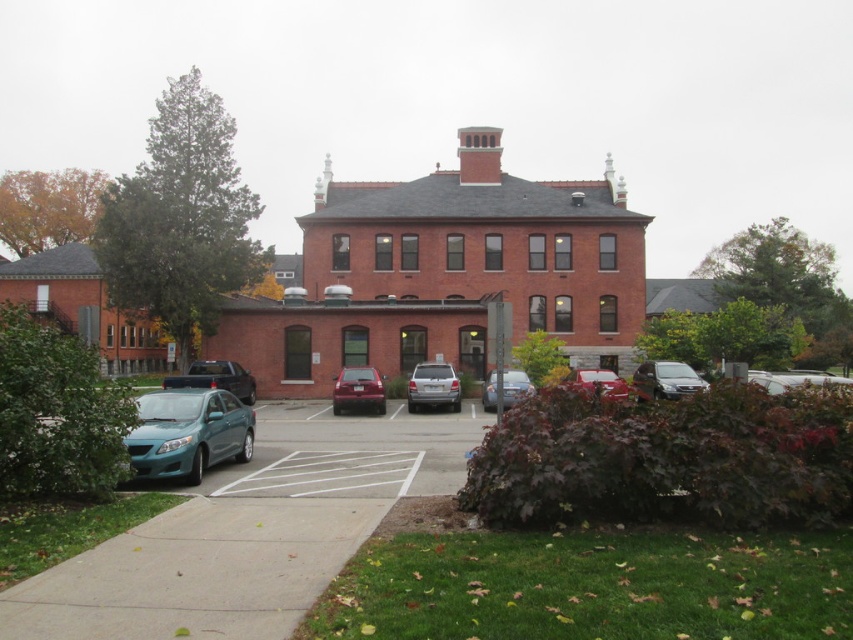
Between satin silver minivan at center and satin silver sedan at center, which one appears on the left side from the viewer's perspective?

From the viewer's perspective, satin silver sedan at center appears more on the left side.

Based on the photo, can you confirm if satin silver minivan at center is positioned above satin silver sedan at center?

Correct, satin silver minivan at center is located above satin silver sedan at center.

Does point (634, 381) come behind point (527, 385)?

That is True.

The width and height of the screenshot is (853, 640). I want to click on satin silver minivan at center, so click(x=665, y=380).

Can you confirm if smooth concrete pavement at lower center is positioned above satin silver suv at center?

Incorrect, smooth concrete pavement at lower center is not positioned above satin silver suv at center.

Does smooth concrete pavement at lower center appear on the right side of satin silver suv at center?

Incorrect, smooth concrete pavement at lower center is not on the right side of satin silver suv at center.

Which is behind, point (339, 550) or point (450, 404)?

Positioned behind is point (450, 404).

Where is `smooth concrete pavement at lower center`? The height and width of the screenshot is (640, 853). smooth concrete pavement at lower center is located at coordinates (250, 531).

Can you confirm if smooth concrete pavement at lower center is taller than satin silver minivan at center?

In fact, smooth concrete pavement at lower center may be shorter than satin silver minivan at center.

Who is more forward, [120,561] or [664,387]?

Point [120,561]

Image resolution: width=853 pixels, height=640 pixels. In order to click on smooth concrete pavement at lower center in this screenshot , I will do `click(250, 531)`.